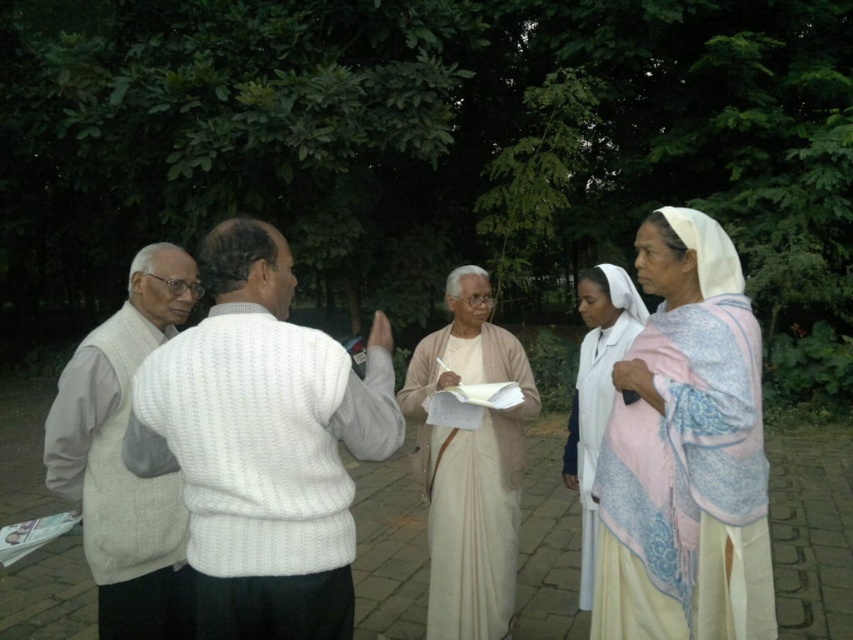
You are organizing a picnic and need to decide which fabric to use as a tablecloth. The light beige fabric at center and the white cloth at right are available. Based on their sizes, which one would be more suitable for covering a standard picnic table?

The light beige fabric at center is wider than the white cloth at right, making it more suitable for covering a standard picnic table.

You are a photographer trying to capture a clear shot of the light beige fabric at center and the white cloth at right. Since the background is slightly out of focus, which object should you focus on to ensure it appears sharp and in focus?

The light beige fabric at center is much taller than the white cloth at right, so focusing on the light beige fabric at center would ensure it appears sharp and in focus.

You are organizing a cultural event and need to arrange seating for participants. The white silk saree at right and the light beige fabric at center are both draped on the ground as seating options. Which fabric provides a wider seating area?

The light beige fabric at center provides a wider seating area since its width is greater than the white silk saree at right.